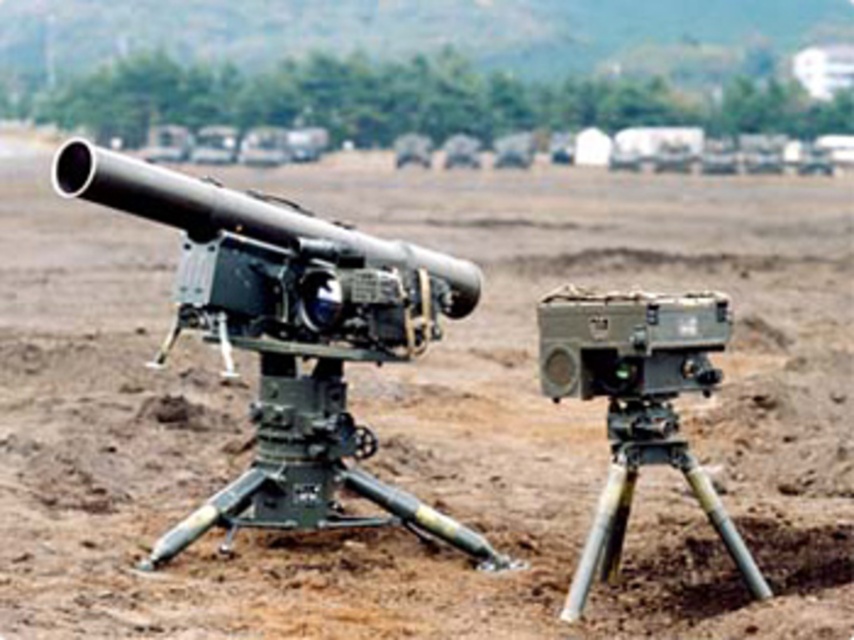
You are a military engineer tasked with aligning equipment. You have a matte black cannon at center and a matte gray video camera at center. The distance between them must be exactly 5 feet for optimal performance. Are they currently positioned correctly?

The matte black cannon at center is 4.50 feet from the matte gray video camera at center. Since the required distance is 5 feet, they are not positioned correctly and need to be moved further apart by 0.5 feet.

You are a military technician inspecting the equipment. You need to move the matte black cannon at center to the right side of the matte gray video camera at center. Which direction should you move it relative to the current position?

The matte black cannon at center is currently on the left side of the matte gray video camera at center. To move it to the right side, you should move it to the right of the matte gray video camera at center.